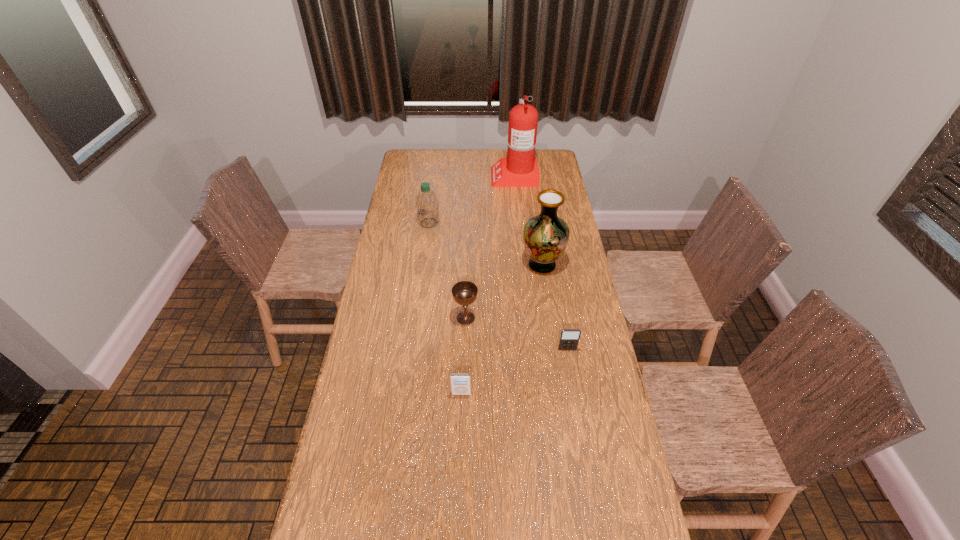
Where is `object located at the far edge`? The height and width of the screenshot is (540, 960). object located at the far edge is located at coordinates [520, 169].

Identify the location of object located at the left edge. (427, 204).

The height and width of the screenshot is (540, 960). Identify the location of fire extinguisher at the right edge. (520, 169).

What are the coordinates of `vase present at the right edge` in the screenshot? It's located at (545, 236).

This screenshot has width=960, height=540. What are the coordinates of `iPod present at the right edge` in the screenshot? It's located at (569, 338).

What are the coordinates of `object situated at the far right corner` in the screenshot? It's located at (520, 169).

What are the coordinates of `free location at the far edge of the desktop` in the screenshot? It's located at (505, 154).

Locate an element on the screen. vacant space at the left edge is located at coordinates (341, 476).

In the image, there is a desktop. Where is `vacant space at the right edge`? The width and height of the screenshot is (960, 540). vacant space at the right edge is located at coordinates (567, 287).

Where is `free point between the fire extinguisher and the left iPod`? The image size is (960, 540). free point between the fire extinguisher and the left iPod is located at coordinates (488, 285).